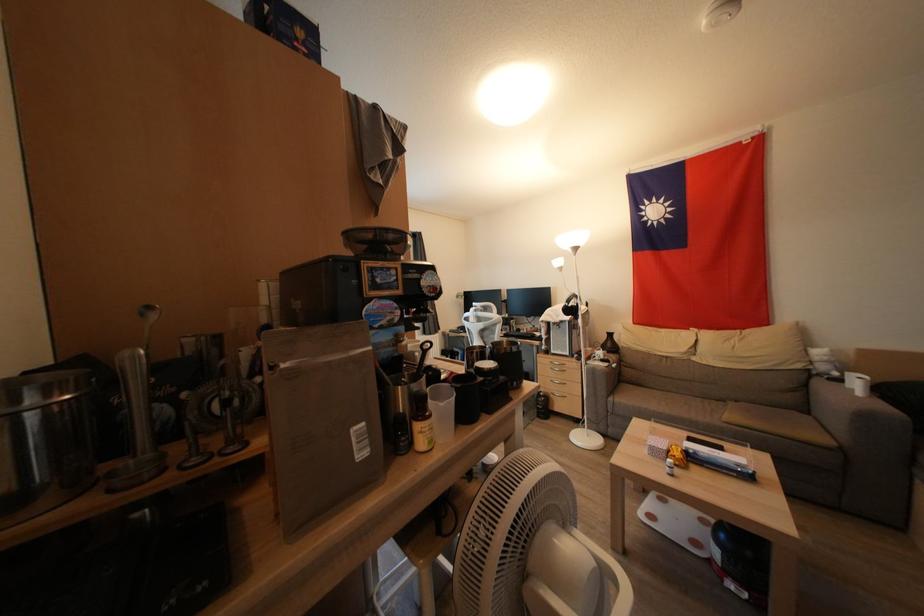
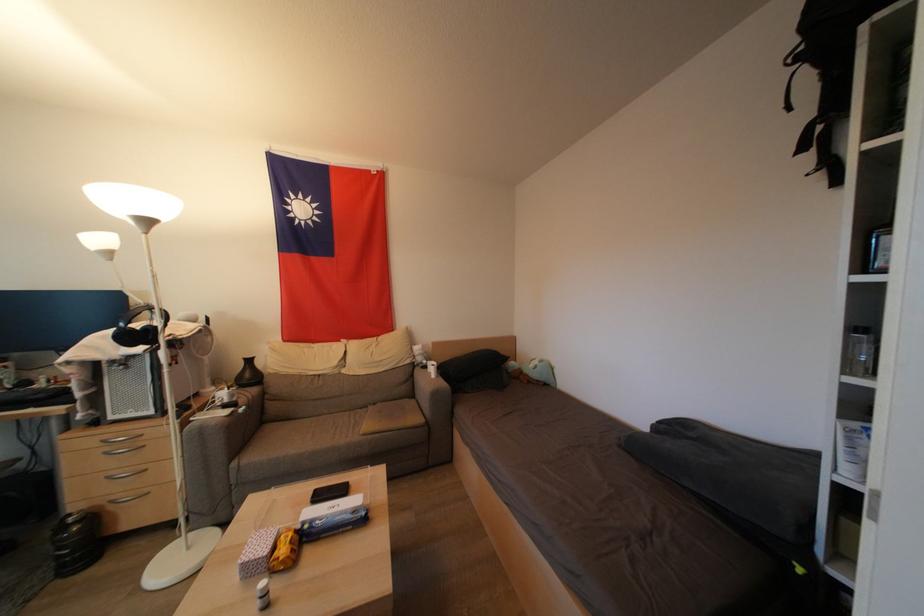
Locate, in the second image, the point that corresponds to pixel 575 315 in the first image.

(142, 339)